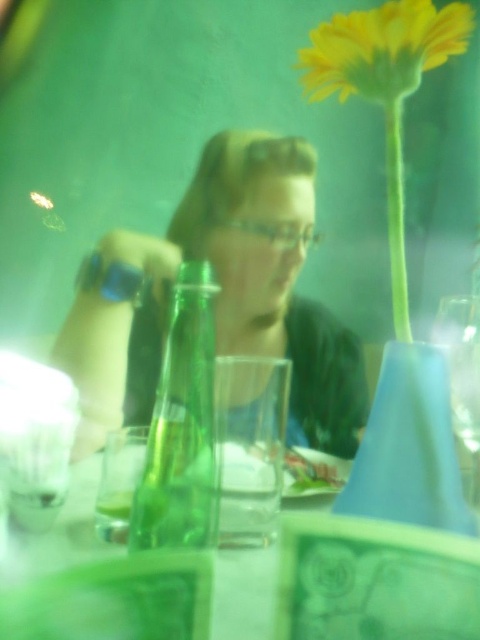
Question: Which object is closer to the camera taking this photo?

Choices:
 (A) transparent glass wine glass at right
 (B) yellow matte flower at upper right
 (C) transparent plastic table at center
 (D) matte black hair at center

Answer: (C)

Question: Is transparent plastic table at center closer to the viewer compared to transparent glass wine glass at right?

Choices:
 (A) no
 (B) yes

Answer: (B)

Question: Among these objects, which one is nearest to the camera?

Choices:
 (A) transparent glass wine glass at right
 (B) transparent plastic table at center
 (C) yellow matte flower at upper right

Answer: (B)

Question: Can you confirm if green glass bottle at center is positioned to the right of transparent plastic table at center?

Choices:
 (A) yes
 (B) no

Answer: (A)

Question: Does transparent plastic table at center appear over transparent glass wine glass at right?

Choices:
 (A) yes
 (B) no

Answer: (B)

Question: Which of the following is the farthest from the observer?

Choices:
 (A) yellow matte flower at upper right
 (B) transparent plastic table at center
 (C) transparent glass wine glass at right

Answer: (C)